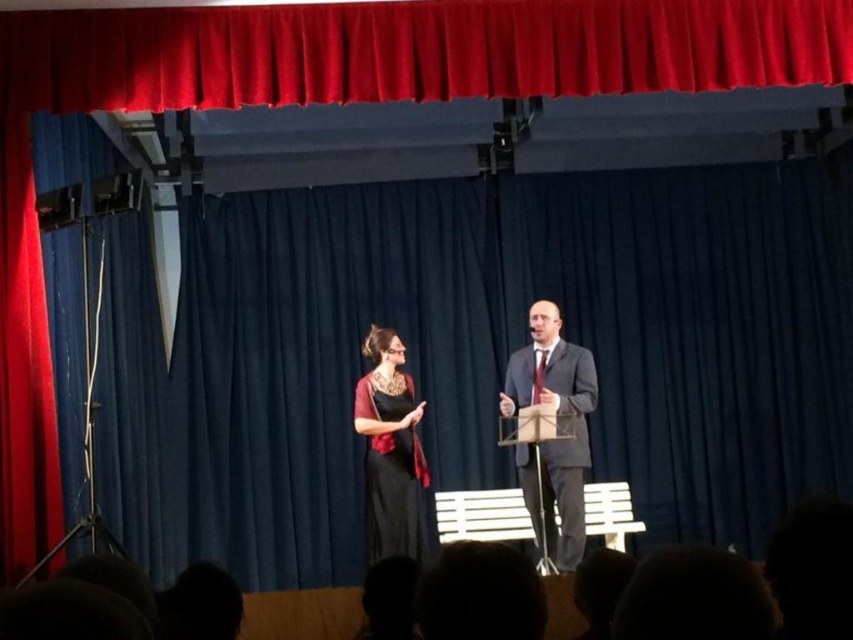
You are an audience member sitting in the front row of the stage. You notice two performers wearing the matte black suit at center and the black satin dress at center. Which performer is standing closer to the front of the stage?

The matte black suit at center is closer to the viewer than the black satin dress at center, so the performer in the matte black suit at center is standing closer to the front of the stage.

You are an audience member sitting in the front row of the stage. You notice two points marked on the stage floor. One is at point (x=569, y=397) and the other is at point (x=389, y=497). Which point appears closer to you?

Point (x=569, y=397) is further to the viewer than point (x=389, y=497), so the point at (x=389, y=497) is closer to you.

You are an event planner arranging the stage for a formal presentation. You need to ensure that the matte black suit at center and the black satin dress at center are visible to the audience. Based on their positions, which one is more likely to be seen by the audience from the front of the stage?

The matte black suit at center is located above the black satin dress at center, so the matte black suit at center is more visible to the audience from the front of the stage.